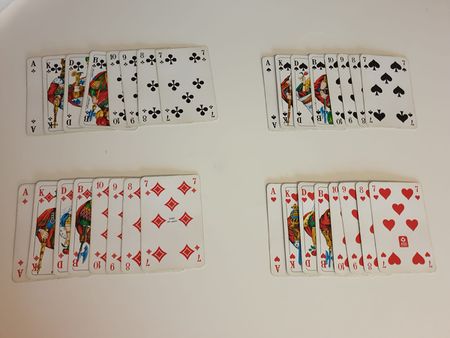
Locate an element on the screen. This screenshot has height=338, width=450. playing cards is located at coordinates (173, 92).